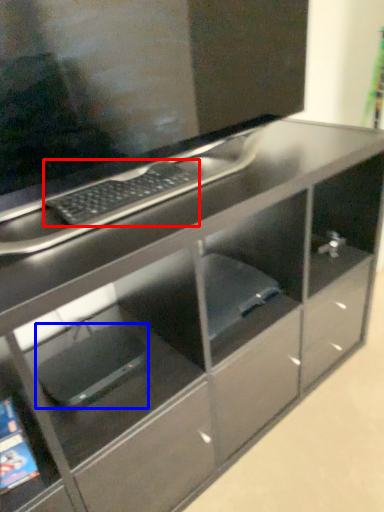
Question: Which point is further to the camera, computer keyboard (highlighted by a red box) or computer (highlighted by a blue box)?

Choices:
 (A) computer keyboard
 (B) computer

Answer: (B)